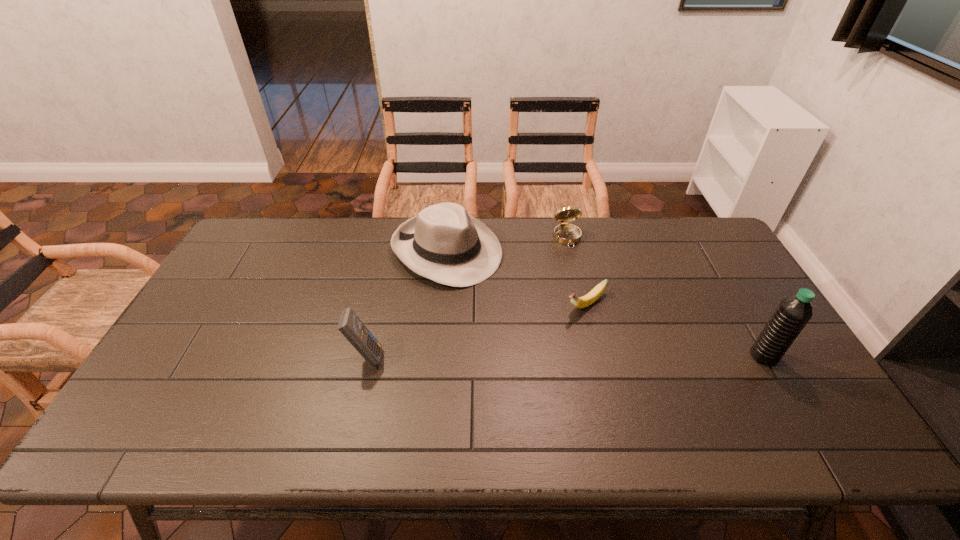
Locate an element on the screen. free space that is in between the banana and the calculator is located at coordinates (476, 330).

Identify the location of blank region between the calculator and the second shortest object. (467, 297).

Find the location of a particular element. The height and width of the screenshot is (540, 960). free space between the calculator and the banana is located at coordinates (476, 330).

The image size is (960, 540). Identify the location of free space between the fourth tallest object and the banana. (576, 271).

You are a GUI agent. You are given a task and a screenshot of the screen. Output one action in this format:
    pyautogui.click(x=<x>, y=<y>)
    Task: Click on the vacant area that lies between the fedora and the water bottle
    
    Given the screenshot: What is the action you would take?
    pyautogui.click(x=605, y=303)

Identify the location of vacant space in between the second shortest object and the banana. tap(576, 271).

This screenshot has height=540, width=960. Find the location of `object that is the fourth closest to the water bottle`. object that is the fourth closest to the water bottle is located at coordinates (353, 329).

Locate which object ranks second in proximity to the second shortest object. Please provide its 2D coordinates. Your answer should be formatted as a tuple, i.e. [(x, y)], where the tuple contains the x and y coordinates of a point satisfying the conditions above.

[(580, 302)]